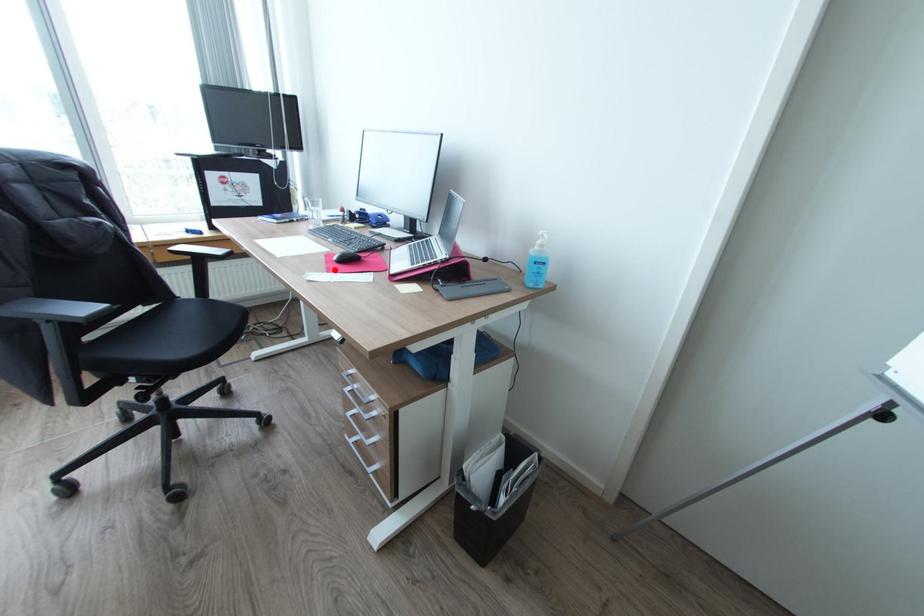
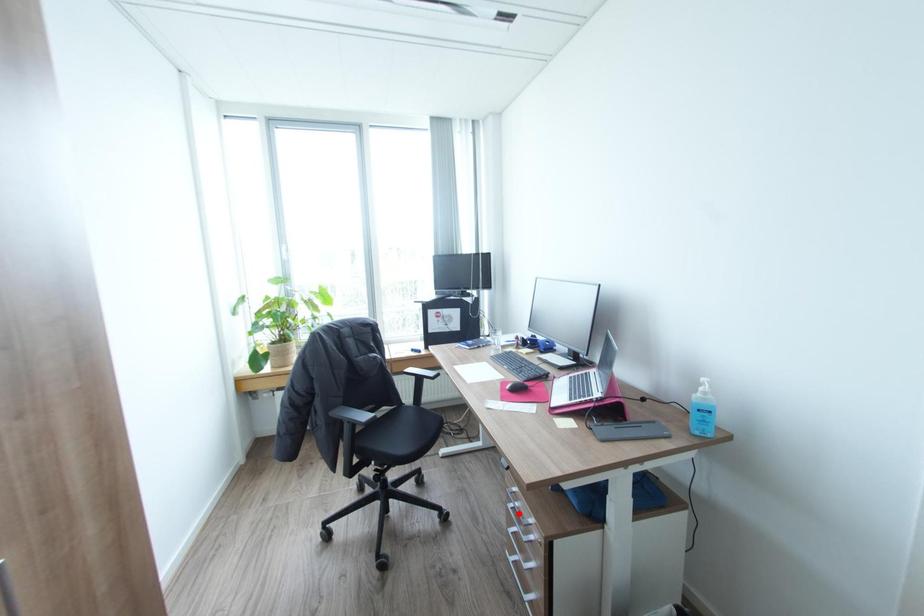
I am providing you with two images of the same scene from different viewpoints. A red point is marked on the first image and another point is marked on the second image. Does the point marked in image1 correspond to the same location as the one in image2?

No